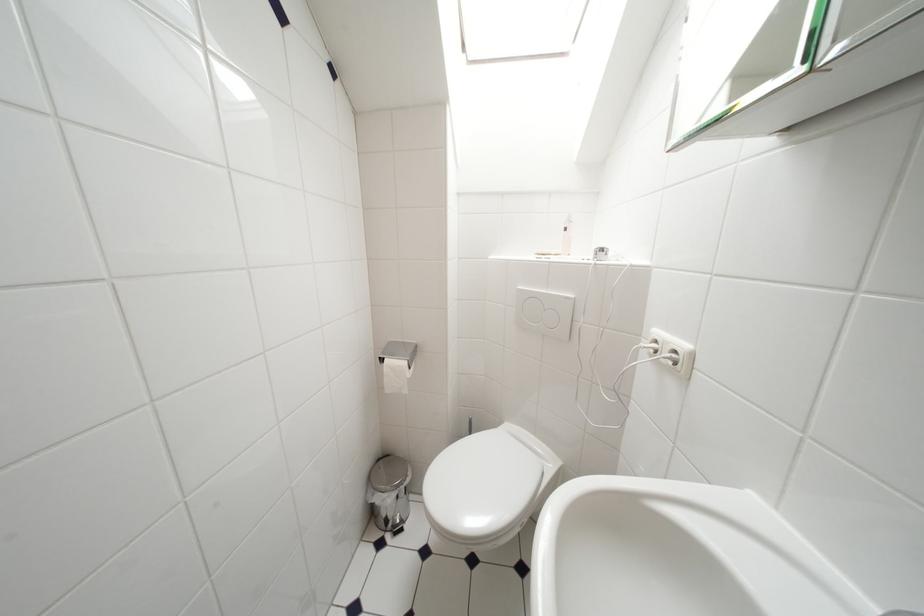
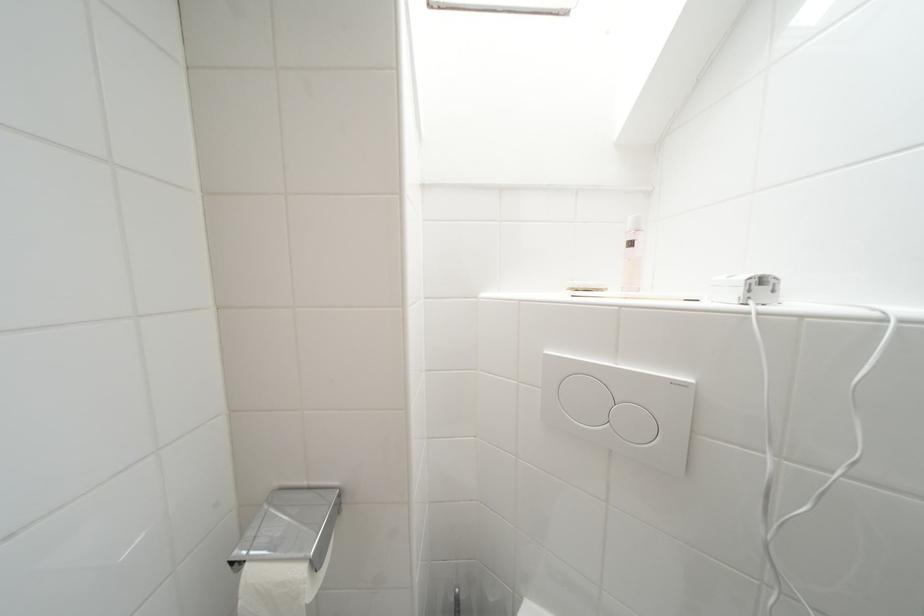
Question: The camera is either moving clockwise (left) or counter-clockwise (right) around the object. The first image is from the beginning of the video and the second image is from the end. Is the camera moving left or right when shooting the video?

Choices:
 (A) Left
 (B) Right

Answer: (A)